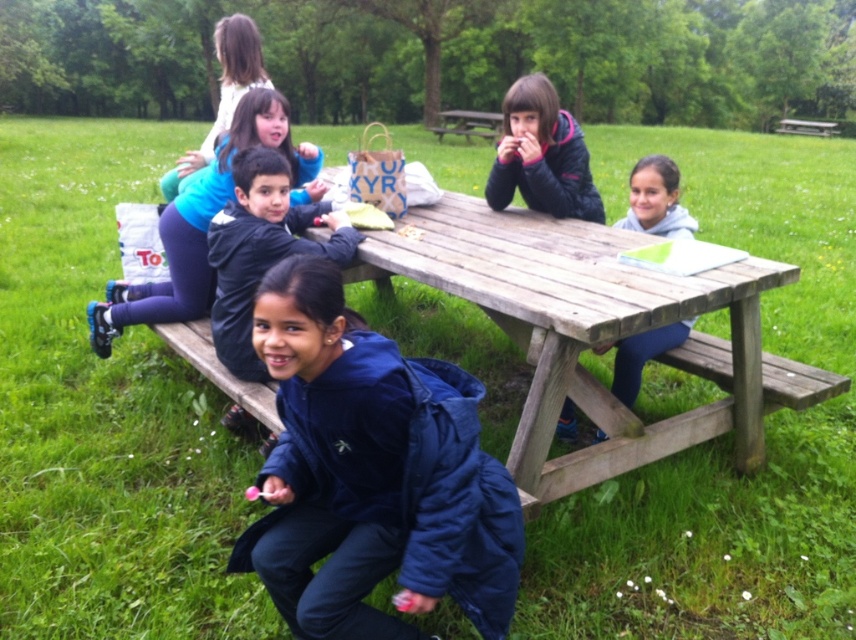
Question: Where is dark blue fleece jacket at lower center located in relation to blue fabric jacket at lower center in the image?

Choices:
 (A) below
 (B) above

Answer: (A)

Question: Which object is the farthest from the dark blue fleece jacket at lower center?

Choices:
 (A) dark blue puffer jacket at center
 (B) light blue jeans at lower right
 (C) wooden picnic table at center

Answer: (A)

Question: Can you confirm if dark blue fleece at center is positioned below light blue jeans at lower right?

Choices:
 (A) yes
 (B) no

Answer: (B)

Question: Which object is closer to the camera taking this photo?

Choices:
 (A) dark blue puffer jacket at center
 (B) light blue jeans at lower right
 (C) wooden bench at upper right

Answer: (B)

Question: Is wooden picnic table at center below dark blue fleece at center?

Choices:
 (A) no
 (B) yes

Answer: (B)

Question: Which point is closer to the camera?

Choices:
 (A) dark blue fleece jacket at lower center
 (B) dark blue fleece at center

Answer: (A)